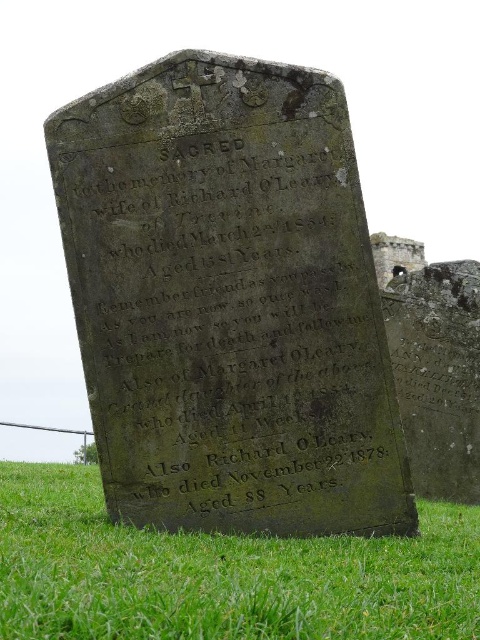
Between weathered stone monument at center and black stone gravestone at lower center, which one is positioned higher?

weathered stone monument at center is above.

Which is more to the right, weathered stone monument at center or black stone gravestone at lower center?

black stone gravestone at lower center

Locate an element on the screen. weathered stone monument at center is located at coordinates (228, 301).